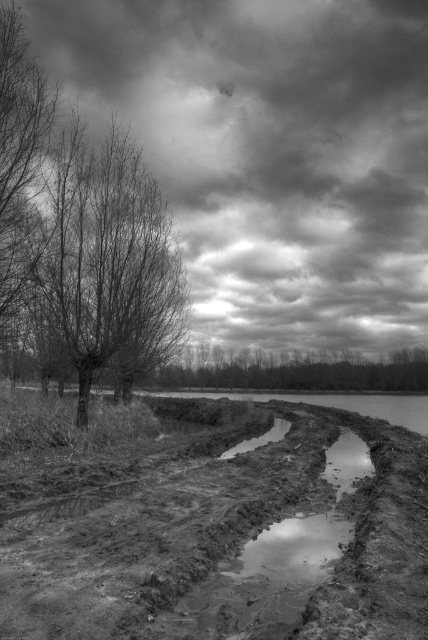
You are an artist planning to paint the scene. You want to emphasize the contrast between the cloudy textured sky at upper center and the smooth bark tree at center. Which object should you make larger in your painting to highlight this contrast?

The cloudy textured sky at upper center is already larger in size than the smooth bark tree at center, so to emphasize the contrast, you should keep the cloudy textured sky at upper center larger in your painting.